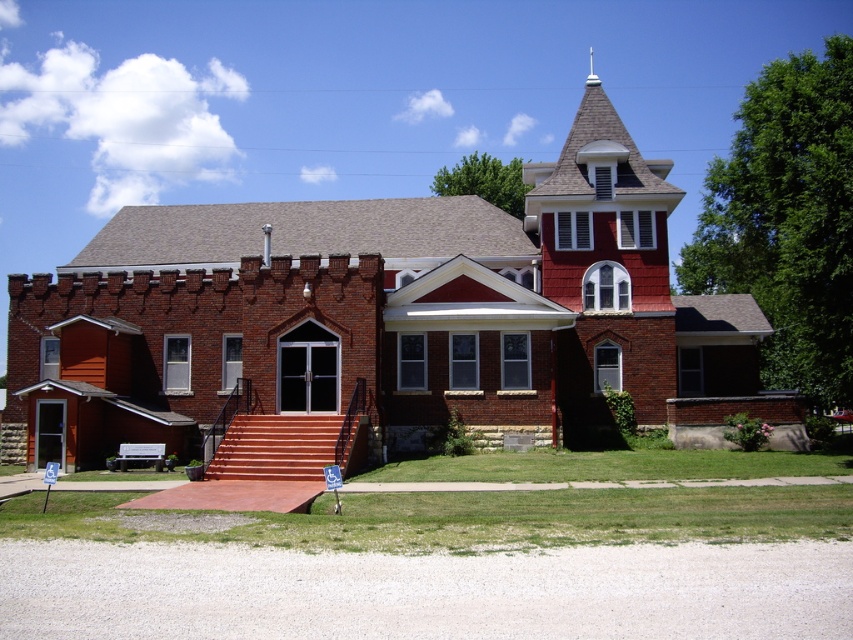
You are standing in front of the red brick church at center and looking towards the shiny copper spire at upper center. Which object is closer to you?

The red brick church at center is closer to the viewer than the shiny copper spire at upper center.